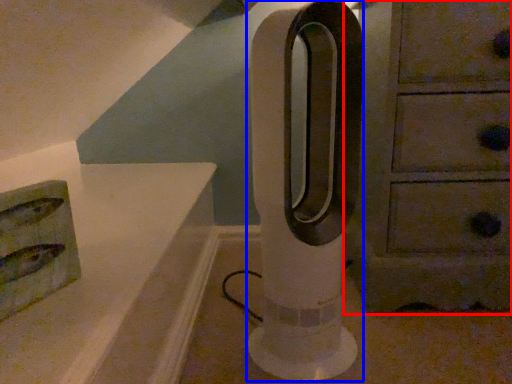
Question: Which object is closer to the camera taking this photo, chest of drawers (highlighted by a red box) or pillar (highlighted by a blue box)?

Choices:
 (A) chest of drawers
 (B) pillar

Answer: (B)